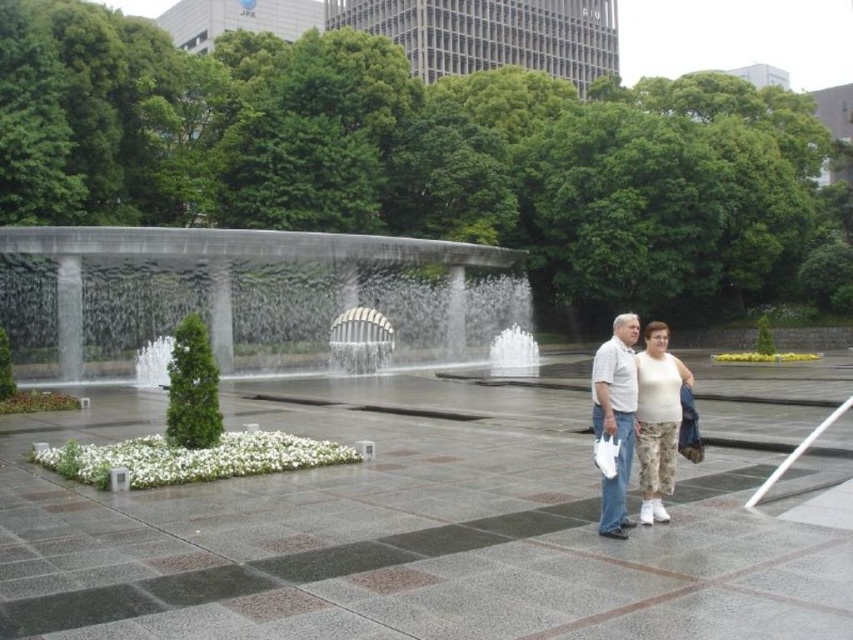
Question: Based on their relative distances, which object is farther from the white cotton shirt at center?

Choices:
 (A) white cotton tank top at lower right
 (B) gray concrete waterfall at center

Answer: (B)

Question: Considering the relative positions of gray concrete waterfall at center and white cotton tank top at lower right in the image provided, where is gray concrete waterfall at center located with respect to white cotton tank top at lower right?

Choices:
 (A) right
 (B) left

Answer: (B)

Question: Which object is closer to the camera taking this photo?

Choices:
 (A) gray concrete waterfall at center
 (B) white cotton shirt at center

Answer: (B)

Question: Can you confirm if gray concrete waterfall at center is wider than white cotton tank top at lower right?

Choices:
 (A) yes
 (B) no

Answer: (A)

Question: Which point is farther from the camera taking this photo?

Choices:
 (A) (663, 464)
 (B) (462, 333)
 (C) (628, 337)

Answer: (B)

Question: Does white cotton tank top at lower right lie behind white cotton shirt at center?

Choices:
 (A) no
 (B) yes

Answer: (B)